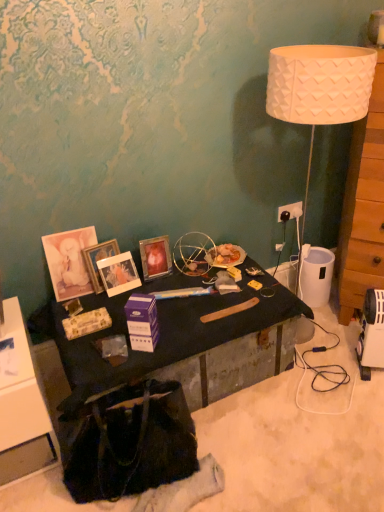
Question: Is wooden dresser at right taller or shorter than metallic gold picture frame at center, the 2th picture frame in the right-to-left sequence?

Choices:
 (A) tall
 (B) short

Answer: (A)

Question: Considering the relative positions of wooden dresser at right and metallic gold picture frame at center, acting as the second picture frame starting from the left, in the image provided, is wooden dresser at right to the left or to the right of metallic gold picture frame at center, acting as the second picture frame starting from the left,?

Choices:
 (A) right
 (B) left

Answer: (A)

Question: Considering the real-world distances, which object is farthest from the black matte desk at center?

Choices:
 (A) purple cardboard box at center
 (B) wooden dresser at right
 (C) matte black cabinet at lower left
 (D) black fabric handbag at lower left
 (E) metallic gold picture frame at center, marked as the first picture frame in a right-to-left arrangement

Answer: (B)

Question: Considering the real-world distances, which object is closest to the white plastic power outlet at upper right?

Choices:
 (A) matte black cabinet at lower left
 (B) wooden dresser at right
 (C) black matte desk at center
 (D) metallic gold picture frame at center, acting as the second picture frame starting from the left
 (E) black fabric handbag at lower left

Answer: (B)